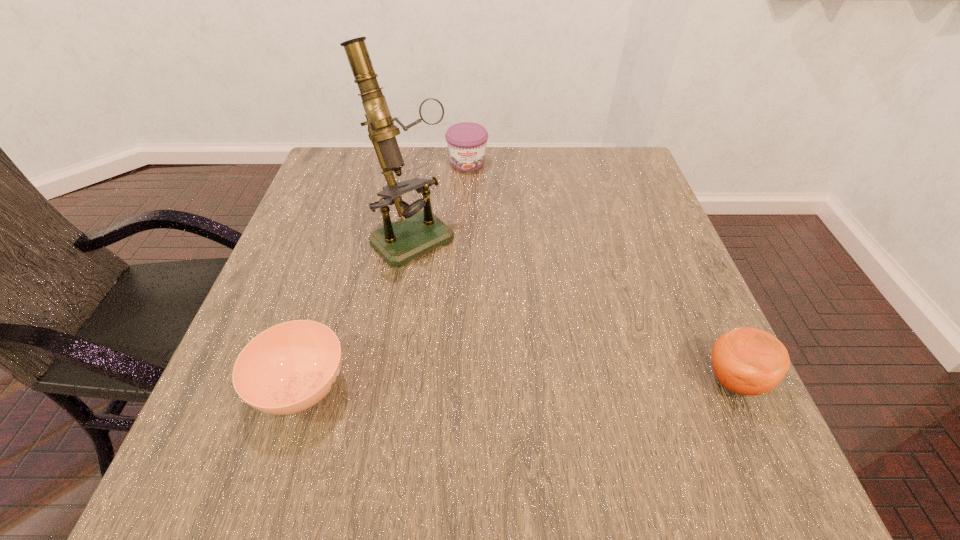
Where is `free space on the desktop that is between the soup bowl and the rightmost object and is positioned at the eyepiece of the tallest object`? The height and width of the screenshot is (540, 960). free space on the desktop that is between the soup bowl and the rightmost object and is positioned at the eyepiece of the tallest object is located at coordinates (562, 382).

Locate an element on the screen. The height and width of the screenshot is (540, 960). free space on the desktop that is between the soup bowl and the orange and is positioned on the front label of the farthest object is located at coordinates (505, 383).